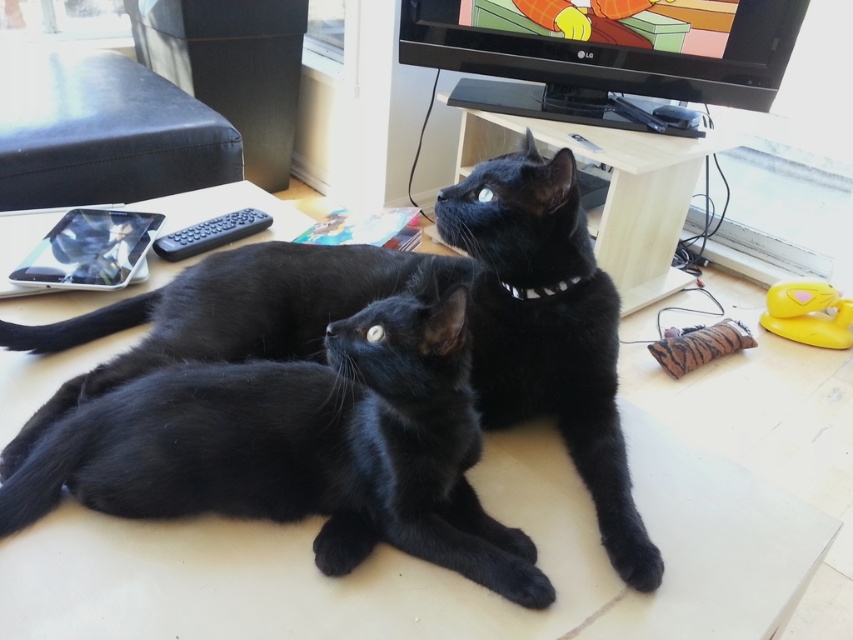
Question: Does shiny black cat at center have a larger size compared to white plastic collar at center?

Choices:
 (A) no
 (B) yes

Answer: (B)

Question: Does shiny black cat at center have a smaller size compared to white plastic collar at center?

Choices:
 (A) no
 (B) yes

Answer: (A)

Question: Is shiny black cat at center to the left of white plastic collar at center from the viewer's perspective?

Choices:
 (A) no
 (B) yes

Answer: (B)

Question: Which point is closer to the camera taking this photo?

Choices:
 (A) (258, 324)
 (B) (532, 298)

Answer: (B)

Question: Which point is closer to the camera taking this photo?

Choices:
 (A) (576, 252)
 (B) (550, 292)

Answer: (A)